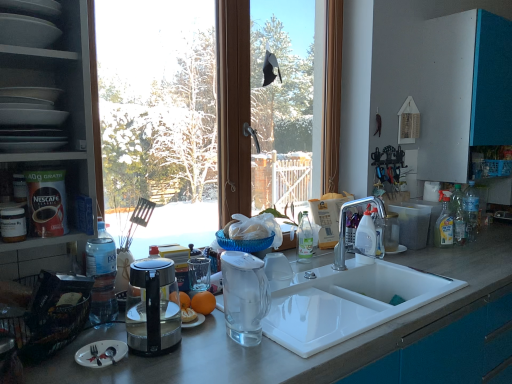
Locate an element on the screen. This screenshot has width=512, height=384. free location to the right of silver matte fork at lower left is located at coordinates (160, 359).